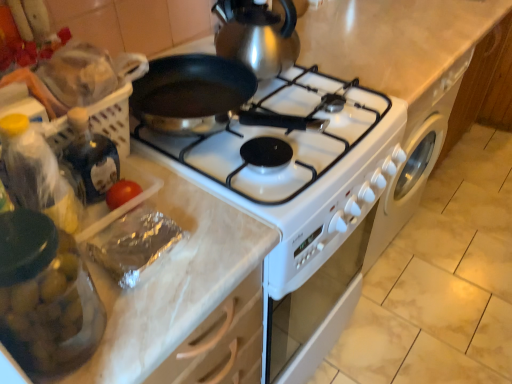
The height and width of the screenshot is (384, 512). Identify the location of unoccupied region to the right of silver foil meat at lower left. pyautogui.click(x=221, y=244).